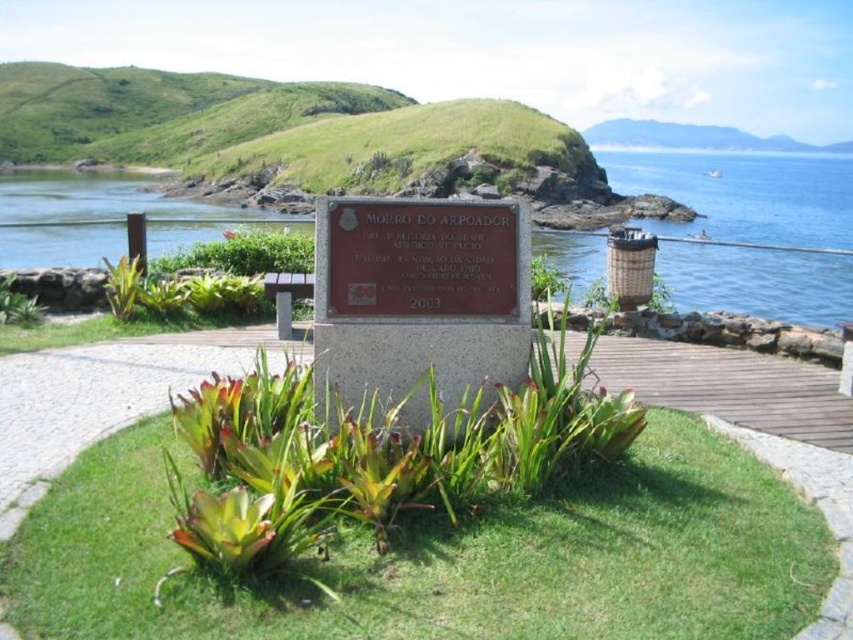
Question: Based on their relative distances, which object is nearer to the green leafy plant at center?

Choices:
 (A) green grass at center
 (B) blue water at left

Answer: (A)

Question: Can you confirm if green grass at center is positioned below green leafy plant at center?

Choices:
 (A) no
 (B) yes

Answer: (B)

Question: Estimate the real-world distances between objects in this image. Which object is closer to the green grass at center?

Choices:
 (A) blue water at left
 (B) green leafy plant at center

Answer: (B)

Question: Does green leafy plant at center appear under blue water at left?

Choices:
 (A) no
 (B) yes

Answer: (B)

Question: Is green leafy plant at center smaller than blue water at left?

Choices:
 (A) yes
 (B) no

Answer: (A)

Question: Which object is the closest to the blue water at left?

Choices:
 (A) green leafy plant at center
 (B) green grass at center

Answer: (A)